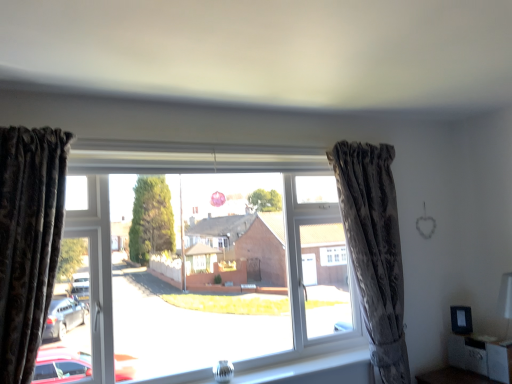
Locate an element on the screen. velvet dark brown curtain at left, placed as the second curtain when sorted from back to front is located at coordinates [28, 240].

Describe the element at coordinates (28, 240) in the screenshot. I see `velvet dark brown curtain at left, the first curtain in the left-to-right sequence` at that location.

The height and width of the screenshot is (384, 512). Identify the location of matte black cabinet at lower right. (481, 357).

Identify the location of transparent glass window at center. (213, 285).

Where is `clear glass vase at lower center`? clear glass vase at lower center is located at coordinates (310, 365).

Is the surface of matte black cabinet at lower right in direct contact with velvet dark brown curtain at left, placed as the second curtain when sorted from back to front?

No, matte black cabinet at lower right is not next to velvet dark brown curtain at left, placed as the second curtain when sorted from back to front.

Which is more to the left, matte black cabinet at lower right or velvet dark brown curtain at left, acting as the 2th curtain starting from the right?

From the viewer's perspective, velvet dark brown curtain at left, acting as the 2th curtain starting from the right, appears more on the left side.

This screenshot has width=512, height=384. What are the coordinates of `the 2nd curtain in front of the matte black cabinet at lower right` in the screenshot? It's located at pos(28,240).

What's the angular difference between matte black cabinet at lower right and velvet dark brown curtain at left, placed as the second curtain when sorted from back to front,'s facing directions?

matte black cabinet at lower right and velvet dark brown curtain at left, placed as the second curtain when sorted from back to front, are facing 89.2 degrees away from each other.

Is clear glass vase at lower center completely or partially inside camouflage fabric curtain at right, the first curtain viewed from the right?

No, clear glass vase at lower center is not inside camouflage fabric curtain at right, the first curtain viewed from the right.

Would you consider camouflage fabric curtain at right, which is the second curtain in front-to-back order, to be distant from clear glass vase at lower center?

No, there isn't a large distance between camouflage fabric curtain at right, which is the second curtain in front-to-back order, and clear glass vase at lower center.

You are a GUI agent. You are given a task and a screenshot of the screen. Output one action in this format:
    pyautogui.click(x=<x>, y=<y>)
    Task: Click on the curtain behind the clear glass vase at lower center
    The width and height of the screenshot is (512, 384).
    Given the screenshot: What is the action you would take?
    pyautogui.click(x=374, y=249)

Is camouflage fabric curtain at right, marked as the second curtain in a left-to-right arrangement, at the left side of clear glass vase at lower center?

No, camouflage fabric curtain at right, marked as the second curtain in a left-to-right arrangement, is not to the left of clear glass vase at lower center.

Does matte black cabinet at lower right touch camouflage fabric curtain at right, which is the first curtain in back-to-front order?

No, matte black cabinet at lower right is not in contact with camouflage fabric curtain at right, which is the first curtain in back-to-front order.

Considering the sizes of objects matte black cabinet at lower right and camouflage fabric curtain at right, which is the second curtain in front-to-back order, in the image provided, who is wider, matte black cabinet at lower right or camouflage fabric curtain at right, which is the second curtain in front-to-back order,?

Wider between the two is matte black cabinet at lower right.

Consider the image. Does matte black cabinet at lower right lie in front of camouflage fabric curtain at right, the first curtain viewed from the right?

No, matte black cabinet at lower right is further to the viewer.

From the image's perspective, is matte black cabinet at lower right on top of camouflage fabric curtain at right, which is the second curtain in front-to-back order?

No, from the image's perspective, matte black cabinet at lower right is not above camouflage fabric curtain at right, which is the second curtain in front-to-back order.

Is clear glass vase at lower center not inside camouflage fabric curtain at right, which is the first curtain in back-to-front order?

clear glass vase at lower center is positioned outside camouflage fabric curtain at right, which is the first curtain in back-to-front order.

Can you confirm if clear glass vase at lower center is bigger than camouflage fabric curtain at right, marked as the second curtain in a left-to-right arrangement?

Incorrect, clear glass vase at lower center is not larger than camouflage fabric curtain at right, marked as the second curtain in a left-to-right arrangement.

Which of these two, clear glass vase at lower center or camouflage fabric curtain at right, the first curtain viewed from the right, stands shorter?

Standing shorter between the two is clear glass vase at lower center.

At what (x,y) coordinates should I click in order to perform the action: click on furniture behind the transparent glass window at center. Please return your answer as a coordinate pair (x, y). This screenshot has width=512, height=384. Looking at the image, I should click on (481, 357).

Is transparent glass window at center smaller than matte black cabinet at lower right?

No.

Considering the positions of objects transparent glass window at center and matte black cabinet at lower right in the image provided, who is more to the right, transparent glass window at center or matte black cabinet at lower right?

matte black cabinet at lower right is more to the right.

Is velvet dark brown curtain at left, the first curtain when ordered from front to back, in contact with clear glass vase at lower center?

No, velvet dark brown curtain at left, the first curtain when ordered from front to back, is not next to clear glass vase at lower center.

Which object is closer to the camera, velvet dark brown curtain at left, the first curtain in the left-to-right sequence, or clear glass vase at lower center?

Positioned in front is velvet dark brown curtain at left, the first curtain in the left-to-right sequence.

From the image's perspective, is velvet dark brown curtain at left, acting as the 2th curtain starting from the right, below clear glass vase at lower center?

Actually, velvet dark brown curtain at left, acting as the 2th curtain starting from the right, appears above clear glass vase at lower center in the image.

Does velvet dark brown curtain at left, acting as the 2th curtain starting from the right, have a larger size compared to clear glass vase at lower center?

Yes, velvet dark brown curtain at left, acting as the 2th curtain starting from the right, is bigger than clear glass vase at lower center.

Considering the sizes of clear glass vase at lower center and matte black cabinet at lower right in the image, is clear glass vase at lower center taller or shorter than matte black cabinet at lower right?

Clearly, clear glass vase at lower center is shorter compared to matte black cabinet at lower right.

From the image's perspective, relative to matte black cabinet at lower right, is clear glass vase at lower center above or below?

clear glass vase at lower center is situated lower than matte black cabinet at lower right in the image.

Does point (316, 380) come closer to viewer compared to point (476, 352)?

Yes, it is in front of point (476, 352).

Locate an element on the screen. The width and height of the screenshot is (512, 384). furniture behind the velvet dark brown curtain at left, acting as the 2th curtain starting from the right is located at coordinates (481, 357).

Identify the location of window sill on the left of camouflage fabric curtain at right, which is the second curtain in front-to-back order. (310, 365).

Considering their positions, is transparent glass window at center positioned closer to clear glass vase at lower center than matte black cabinet at lower right?

Among the two, transparent glass window at center is located nearer to clear glass vase at lower center.

Based on their spatial positions, is matte black cabinet at lower right or transparent glass window at center further from clear glass vase at lower center?

The object further to clear glass vase at lower center is matte black cabinet at lower right.

In the scene shown: Estimate the real-world distances between objects in this image. Which object is further from velvet dark brown curtain at left, acting as the 2th curtain starting from the right, camouflage fabric curtain at right, the first curtain viewed from the right, or transparent glass window at center?

The object further to velvet dark brown curtain at left, acting as the 2th curtain starting from the right, is camouflage fabric curtain at right, the first curtain viewed from the right.

Looking at the image, which one is located further to velvet dark brown curtain at left, placed as the second curtain when sorted from back to front, matte black cabinet at lower right or camouflage fabric curtain at right, which is the first curtain in back-to-front order?

matte black cabinet at lower right is further to velvet dark brown curtain at left, placed as the second curtain when sorted from back to front.

Considering their positions, is velvet dark brown curtain at left, placed as the second curtain when sorted from back to front, positioned closer to clear glass vase at lower center than camouflage fabric curtain at right, the first curtain viewed from the right?

Among the two, camouflage fabric curtain at right, the first curtain viewed from the right, is located nearer to clear glass vase at lower center.

Estimate the real-world distances between objects in this image. Which object is further from velvet dark brown curtain at left, the first curtain when ordered from front to back, matte black cabinet at lower right or clear glass vase at lower center?

The object further to velvet dark brown curtain at left, the first curtain when ordered from front to back, is matte black cabinet at lower right.

From the image, which object appears to be nearer to clear glass vase at lower center, matte black cabinet at lower right or velvet dark brown curtain at left, placed as the second curtain when sorted from back to front?

Among the two, matte black cabinet at lower right is located nearer to clear glass vase at lower center.

Considering their positions, is clear glass vase at lower center positioned further to camouflage fabric curtain at right, which is the first curtain in back-to-front order, than transparent glass window at center?

Among the two, clear glass vase at lower center is located further to camouflage fabric curtain at right, which is the first curtain in back-to-front order.

The height and width of the screenshot is (384, 512). I want to click on curtain between transparent glass window at center and matte black cabinet at lower right, so click(x=374, y=249).

At what (x,y) coordinates should I click in order to perform the action: click on curtain situated between velvet dark brown curtain at left, acting as the 2th curtain starting from the right, and matte black cabinet at lower right from left to right. Please return your answer as a coordinate pair (x, y). Looking at the image, I should click on (374, 249).

Identify the location of window between velvet dark brown curtain at left, the first curtain in the left-to-right sequence, and matte black cabinet at lower right, in the horizontal direction. This screenshot has width=512, height=384. (213, 285).

Where is `window sill located between velvet dark brown curtain at left, placed as the second curtain when sorted from back to front, and matte black cabinet at lower right in the left-right direction`? The image size is (512, 384). window sill located between velvet dark brown curtain at left, placed as the second curtain when sorted from back to front, and matte black cabinet at lower right in the left-right direction is located at coordinates (310, 365).